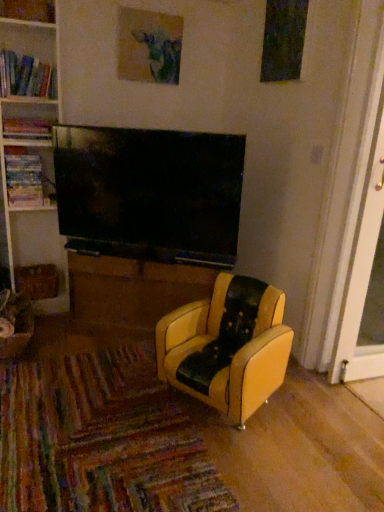
You are a GUI agent. You are given a task and a screenshot of the screen. Output one action in this format:
    pyautogui.click(x=<x>, y=<y>)
    Task: Click on the wooden bookshelf at upper left
    
    Given the screenshot: What is the action you would take?
    pyautogui.click(x=28, y=10)

This screenshot has width=384, height=512. What are the coordinates of `matte paper picture frame at upper center` in the screenshot? It's located at (149, 46).

Measure the distance between brown wood table at center and camera.

The depth of brown wood table at center is 2.29 meters.

What do you see at coordinates (27, 128) in the screenshot? This screenshot has width=384, height=512. I see `hardcover book at left, marked as the 2th book in a top-to-bottom arrangement` at bounding box center [27, 128].

Locate an element on the screen. The width and height of the screenshot is (384, 512). hardcover books at left, the 3th book positioned from the bottom is located at coordinates (26, 76).

Is multicolored cardboard book at left, the third book when ordered from top to bottom, positioned before hardcover books at left, which ranks as the first book in top-to-bottom order?

No, the depth of multicolored cardboard book at left, the third book when ordered from top to bottom, is greater than that of hardcover books at left, which ranks as the first book in top-to-bottom order.

Can you tell me how much multicolored cardboard book at left, which is the first book in bottom-to-top order, and hardcover books at left, the 3th book positioned from the bottom, differ in facing direction?

0.94 degrees separate the facing orientations of multicolored cardboard book at left, which is the first book in bottom-to-top order, and hardcover books at left, the 3th book positioned from the bottom.

Starting from the hardcover books at left, which ranks as the first book in top-to-bottom order, which book is the 2nd one to the left? Please provide its 2D coordinates.

[(26, 178)]

From a real-world perspective, is multicolored cardboard book at left, the third book when ordered from top to bottom, physically located above or below hardcover books at left, the 3th book positioned from the bottom?

multicolored cardboard book at left, the third book when ordered from top to bottom, is situated lower than hardcover books at left, the 3th book positioned from the bottom, in the real world.

In the scene shown: What's the angular difference between yellow leather chair at center and wooden bookshelf at upper left's facing directions?

44.6 degrees.

Considering the sizes of yellow leather chair at center and wooden bookshelf at upper left in the image, is yellow leather chair at center taller or shorter than wooden bookshelf at upper left?

→ Considering their sizes, yellow leather chair at center has more height than wooden bookshelf at upper left.

Does yellow leather chair at center have a larger size compared to wooden bookshelf at upper left?

Yes.

Is there a large distance between brown wood table at center and hardcover book at left, which appears as the 2th book when ordered from the bottom?

That's not correct — brown wood table at center is a little close to hardcover book at left, which appears as the 2th book when ordered from the bottom.

Is brown wood table at center inside or outside of hardcover book at left, marked as the 2th book in a top-to-bottom arrangement?

brown wood table at center is located beyond the bounds of hardcover book at left, marked as the 2th book in a top-to-bottom arrangement.

From the image's perspective, between brown wood table at center and hardcover book at left, marked as the 2th book in a top-to-bottom arrangement, who is located below?

brown wood table at center, from the image's perspective.

Which is behind, point (154, 280) or point (33, 131)?

The point (33, 131) is farther.

Based on the photo, is brown wood table at center not near white plastic screen door at right?

brown wood table at center is positioned a significant distance from white plastic screen door at right.

Would you say brown wood table at center is outside white plastic screen door at right?

brown wood table at center is positioned outside white plastic screen door at right.

Between brown wood table at center and white plastic screen door at right, which one has larger width?

Wider between the two is white plastic screen door at right.

Considering the positions of objects brown wood table at center and white plastic screen door at right in the image provided, who is behind, brown wood table at center or white plastic screen door at right?

Positioned behind is brown wood table at center.

Based on the photo, is matte paper picture frame at upper center at the left side of hardcover books at left, which ranks as the first book in top-to-bottom order?

No.

Based on the photo, from the image's perspective, is matte paper picture frame at upper center above hardcover books at left, which ranks as the first book in top-to-bottom order?

Indeed, from the image's perspective, matte paper picture frame at upper center is shown above hardcover books at left, which ranks as the first book in top-to-bottom order.

Which object is wider, matte paper picture frame at upper center or hardcover books at left, which ranks as the first book in top-to-bottom order?

Wider between the two is hardcover books at left, which ranks as the first book in top-to-bottom order.

Considering the points (147, 12) and (27, 72), which point is behind, point (147, 12) or point (27, 72)?

The point (147, 12) is farther from the camera.

Identify the location of screen door on the right of hardcover book at left, which appears as the 2th book when ordered from the bottom. (362, 276).

Is hardcover book at left, which appears as the 2th book when ordered from the bottom, oriented towards white plastic screen door at right?

No, hardcover book at left, which appears as the 2th book when ordered from the bottom, is not turned towards white plastic screen door at right.

Is hardcover book at left, marked as the 2th book in a top-to-bottom arrangement, positioned beyond the bounds of white plastic screen door at right?

hardcover book at left, marked as the 2th book in a top-to-bottom arrangement, lies outside white plastic screen door at right's area.

From a real-world perspective, relative to white plastic screen door at right, is hardcover book at left, which appears as the 2th book when ordered from the bottom, vertically above or below?

In terms of real-world spatial position, hardcover book at left, which appears as the 2th book when ordered from the bottom, is above white plastic screen door at right.

Can you tell me how much wooden bookshelf at upper left and matte paper picture frame at upper center differ in facing direction?

There is a 12.6-degree angle between the facing directions of wooden bookshelf at upper left and matte paper picture frame at upper center.

Is wooden bookshelf at upper left wider or thinner than matte paper picture frame at upper center?

Considering their sizes, wooden bookshelf at upper left looks broader than matte paper picture frame at upper center.

Would you consider wooden bookshelf at upper left to be distant from matte paper picture frame at upper center?

No, wooden bookshelf at upper left is not far away from matte paper picture frame at upper center.

From a real-world perspective, which book is the 2nd one underneath the hardcover books at left, which ranks as the first book in top-to-bottom order? Please provide its 2D coordinates.

[(26, 178)]

The height and width of the screenshot is (512, 384). What are the coordinates of `chair in front of the wooden bookshelf at upper left` in the screenshot? It's located at (227, 346).

When comparing their distances from wooden bookshelf at upper left, does hardcover book at left, which appears as the 2th book when ordered from the bottom, or hardcover books at left, which ranks as the first book in top-to-bottom order, seem further?

Among the two, hardcover book at left, which appears as the 2th book when ordered from the bottom, is located further to wooden bookshelf at upper left.

From the image, which object appears to be farther from brown wood table at center, wooden bookshelf at upper left or hardcover books at left, which ranks as the first book in top-to-bottom order?

Among the two, wooden bookshelf at upper left is located further to brown wood table at center.

From the image, which object appears to be farther from wooden bookshelf at upper left, white plastic screen door at right or hardcover book at left, marked as the 2th book in a top-to-bottom arrangement?

white plastic screen door at right.

Based on their spatial positions, is yellow leather chair at center or wooden bookshelf at upper left further from brown wood table at center?

Based on the image, wooden bookshelf at upper left appears to be further to brown wood table at center.

Based on their spatial positions, is wooden bookshelf at upper left or hardcover books at left, the 3th book positioned from the bottom, closer to multicolored cardboard book at left, the third book when ordered from top to bottom?

Among the two, hardcover books at left, the 3th book positioned from the bottom, is located nearer to multicolored cardboard book at left, the third book when ordered from top to bottom.

Estimate the real-world distances between objects in this image. Which object is further from hardcover books at left, which ranks as the first book in top-to-bottom order, multicolored cardboard book at left, which is the first book in bottom-to-top order, or white plastic screen door at right?

The object further to hardcover books at left, which ranks as the first book in top-to-bottom order, is white plastic screen door at right.

From the image, which object appears to be nearer to brown wood table at center, matte paper picture frame at upper center or wooden bookshelf at upper left?

matte paper picture frame at upper center is positioned closer to the anchor brown wood table at center.

When comparing their distances from multicolored cardboard book at left, which is the first book in bottom-to-top order, does brown wood table at center or hardcover book at left, which appears as the 2th book when ordered from the bottom, seem further?

Among the two, brown wood table at center is located further to multicolored cardboard book at left, which is the first book in bottom-to-top order.

What are the coordinates of `shelf situated between hardcover book at left, marked as the 2th book in a top-to-bottom arrangement, and matte paper picture frame at upper center from left to right` in the screenshot? It's located at (28, 10).

Locate an element on the screen. The image size is (384, 512). screen door that lies between matte paper picture frame at upper center and yellow leather chair at center from top to bottom is located at coordinates (362, 276).

Where is `shelf between multicolored cardboard book at left, which is the first book in bottom-to-top order, and white plastic screen door at right from left to right`? Image resolution: width=384 pixels, height=512 pixels. shelf between multicolored cardboard book at left, which is the first book in bottom-to-top order, and white plastic screen door at right from left to right is located at coordinates click(x=28, y=10).

The image size is (384, 512). Identify the location of shelf between hardcover books at left, the 3th book positioned from the bottom, and white plastic screen door at right from left to right. (28, 10).